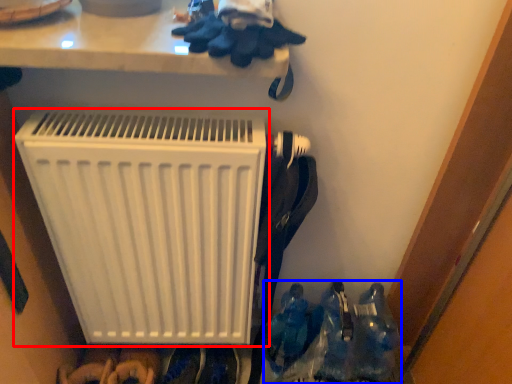
Question: Which of the following is the closest to the observer, home appliance (highlighted by a red box) or footwear (highlighted by a blue box)?

Choices:
 (A) home appliance
 (B) footwear

Answer: (A)